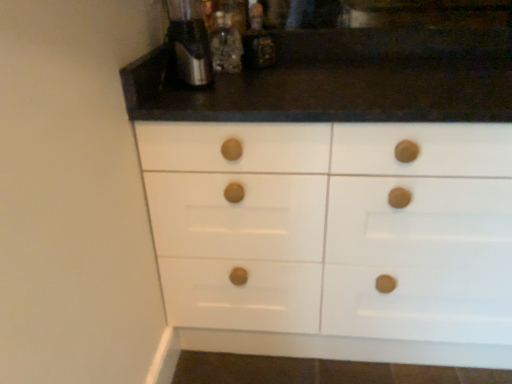
Question: In which direction should I rotate to look at translucent glass bottle at upper center, the first bottle when ordered from left to right?

Choices:
 (A) right
 (B) left

Answer: (B)

Question: Considering the relative sizes of metallic silver bottle at upper center, acting as the second bottle starting from the left, and satin silver coffee machine at upper center in the image provided, is metallic silver bottle at upper center, acting as the second bottle starting from the left, taller than satin silver coffee machine at upper center?

Choices:
 (A) yes
 (B) no

Answer: (B)

Question: From a real-world perspective, is metallic silver bottle at upper center, the first bottle when ordered from right to left, located beneath satin silver coffee machine at upper center?

Choices:
 (A) yes
 (B) no

Answer: (A)

Question: Considering the relative positions of metallic silver bottle at upper center, acting as the second bottle starting from the left, and satin silver coffee machine at upper center in the image provided, is metallic silver bottle at upper center, acting as the second bottle starting from the left, to the right of satin silver coffee machine at upper center from the viewer's perspective?

Choices:
 (A) no
 (B) yes

Answer: (B)

Question: Is metallic silver bottle at upper center, the first bottle when ordered from right to left, outside satin silver coffee machine at upper center?

Choices:
 (A) no
 (B) yes

Answer: (B)

Question: Does metallic silver bottle at upper center, acting as the second bottle starting from the left, have a greater width compared to satin silver coffee machine at upper center?

Choices:
 (A) yes
 (B) no

Answer: (B)

Question: Considering the relative sizes of metallic silver bottle at upper center, the first bottle when ordered from right to left, and satin silver coffee machine at upper center in the image provided, is metallic silver bottle at upper center, the first bottle when ordered from right to left, bigger than satin silver coffee machine at upper center?

Choices:
 (A) yes
 (B) no

Answer: (B)

Question: Is satin silver coffee machine at upper center directly adjacent to translucent glass bottle at upper center, the first bottle when ordered from left to right?

Choices:
 (A) yes
 (B) no

Answer: (B)

Question: From a real-world perspective, does satin silver coffee machine at upper center stand above translucent glass bottle at upper center, which is the second bottle from right to left?

Choices:
 (A) yes
 (B) no

Answer: (A)

Question: From the image's perspective, is satin silver coffee machine at upper center under translucent glass bottle at upper center, the first bottle when ordered from left to right?

Choices:
 (A) yes
 (B) no

Answer: (A)

Question: Can you confirm if satin silver coffee machine at upper center is taller than translucent glass bottle at upper center, the first bottle when ordered from left to right?

Choices:
 (A) no
 (B) yes

Answer: (B)

Question: Can you confirm if satin silver coffee machine at upper center is smaller than translucent glass bottle at upper center, the first bottle when ordered from left to right?

Choices:
 (A) no
 (B) yes

Answer: (A)

Question: Does satin silver coffee machine at upper center have a lesser width compared to translucent glass bottle at upper center, the first bottle when ordered from left to right?

Choices:
 (A) yes
 (B) no

Answer: (B)

Question: Is satin silver coffee machine at upper center at the left side of metallic silver bottle at upper center, acting as the second bottle starting from the left?

Choices:
 (A) no
 (B) yes

Answer: (B)